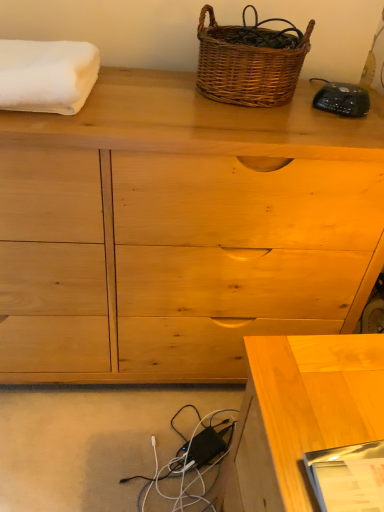
Question: Does light wood desk at lower right have a greater width compared to natural wood chest of drawers at center?

Choices:
 (A) yes
 (B) no

Answer: (B)

Question: Can you confirm if light wood desk at lower right is positioned to the right of natural wood chest of drawers at center?

Choices:
 (A) no
 (B) yes

Answer: (B)

Question: Is light wood desk at lower right far from natural wood chest of drawers at center?

Choices:
 (A) no
 (B) yes

Answer: (A)

Question: Is the position of light wood desk at lower right more distant than that of natural wood chest of drawers at center?

Choices:
 (A) yes
 (B) no

Answer: (B)

Question: Considering the relative sizes of light wood desk at lower right and natural wood chest of drawers at center in the image provided, is light wood desk at lower right bigger than natural wood chest of drawers at center?

Choices:
 (A) no
 (B) yes

Answer: (A)

Question: In terms of height, does light wood desk at lower right look taller or shorter compared to woven brown picnic basket at upper center?

Choices:
 (A) tall
 (B) short

Answer: (A)

Question: From the image's perspective, relative to woven brown picnic basket at upper center, is light wood desk at lower right above or below?

Choices:
 (A) below
 (B) above

Answer: (A)

Question: Considering the positions of point (296, 386) and point (268, 93), is point (296, 386) closer or farther from the camera than point (268, 93)?

Choices:
 (A) closer
 (B) farther

Answer: (A)

Question: Looking at their shapes, would you say light wood desk at lower right is wider or thinner than woven brown picnic basket at upper center?

Choices:
 (A) thin
 (B) wide

Answer: (B)

Question: From the image's perspective, is black plastic remote at upper right positioned above or below light wood desk at lower right?

Choices:
 (A) above
 (B) below

Answer: (A)

Question: Considering the positions of point (354, 86) and point (372, 352), is point (354, 86) closer or farther from the camera than point (372, 352)?

Choices:
 (A) farther
 (B) closer

Answer: (A)

Question: Is black plastic remote at upper right taller or shorter than light wood desk at lower right?

Choices:
 (A) tall
 (B) short

Answer: (B)

Question: Considering the positions of black plastic remote at upper right and light wood desk at lower right in the image, is black plastic remote at upper right bigger or smaller than light wood desk at lower right?

Choices:
 (A) small
 (B) big

Answer: (A)

Question: From a real-world perspective, relative to woven brown picnic basket at upper center, is black plastic remote at upper right vertically above or below?

Choices:
 (A) above
 (B) below

Answer: (B)

Question: From their relative heights in the image, would you say black plastic remote at upper right is taller or shorter than woven brown picnic basket at upper center?

Choices:
 (A) tall
 (B) short

Answer: (B)